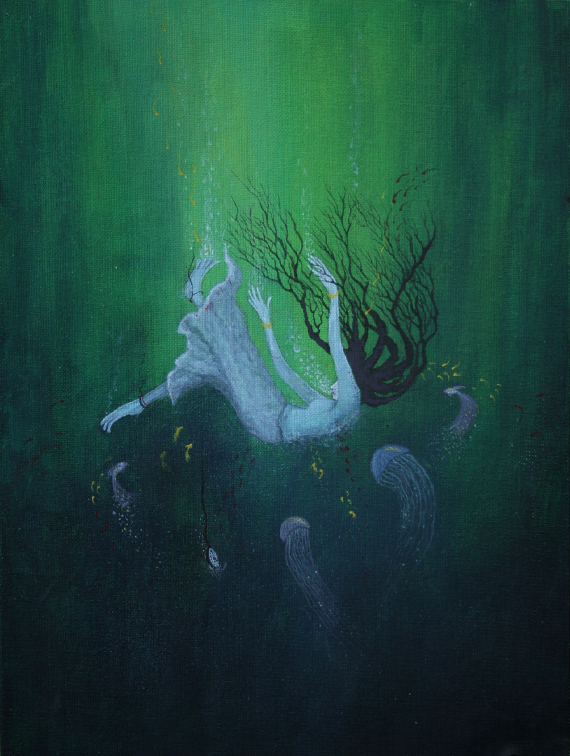
Where is `painting`? The height and width of the screenshot is (756, 570). painting is located at coordinates (302, 386).